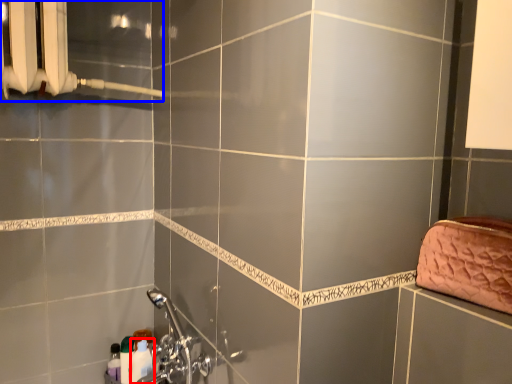
Question: Among these objects, which one is nearest to the camera, toiletry (highlighted by a red box) or shower (highlighted by a blue box)?

Choices:
 (A) toiletry
 (B) shower

Answer: (B)